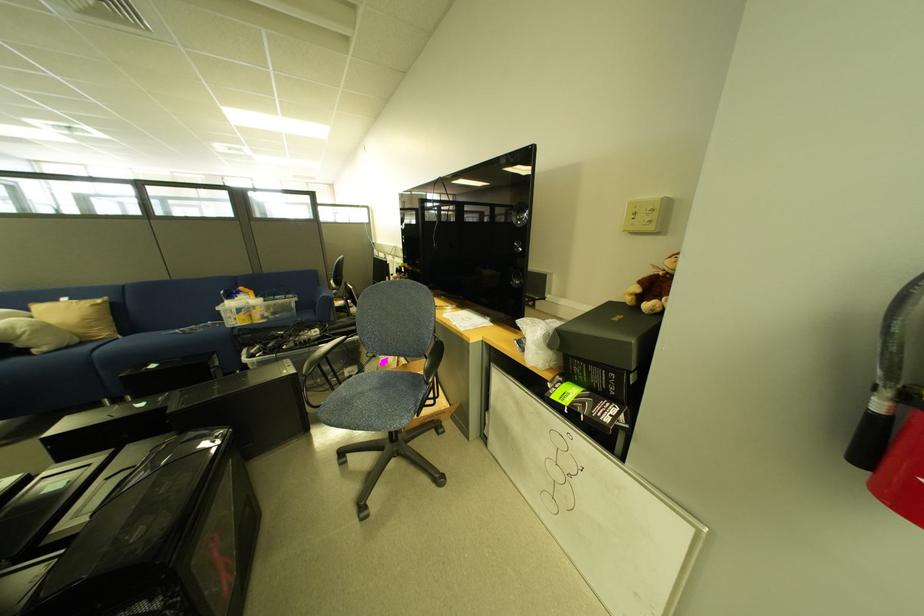
You are a GUI agent. You are given a task and a screenshot of the screen. Output one action in this format:
    pyautogui.click(x=<x>, y=<y>)
    Task: Click on the light switch
    
    Given the screenshot: What is the action you would take?
    click(641, 215)